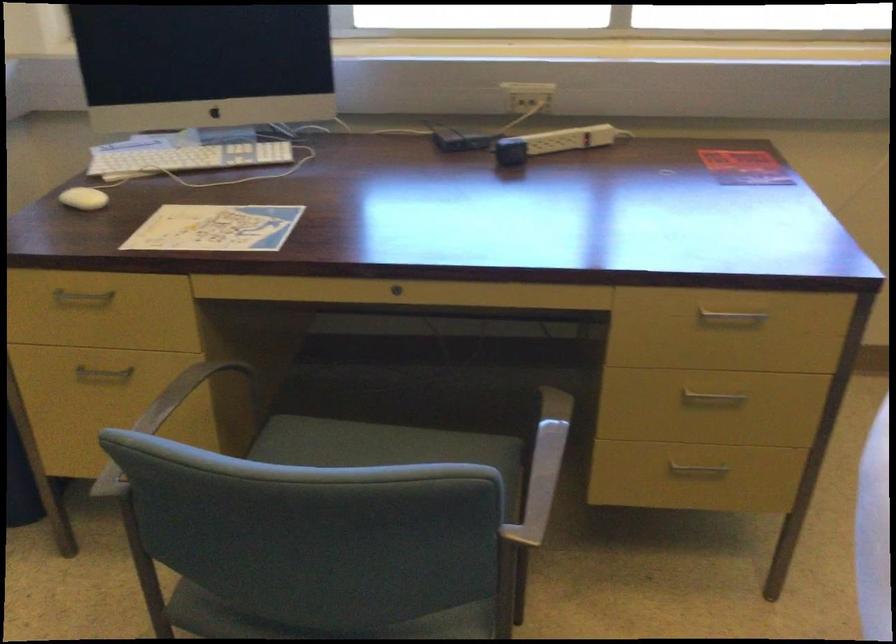
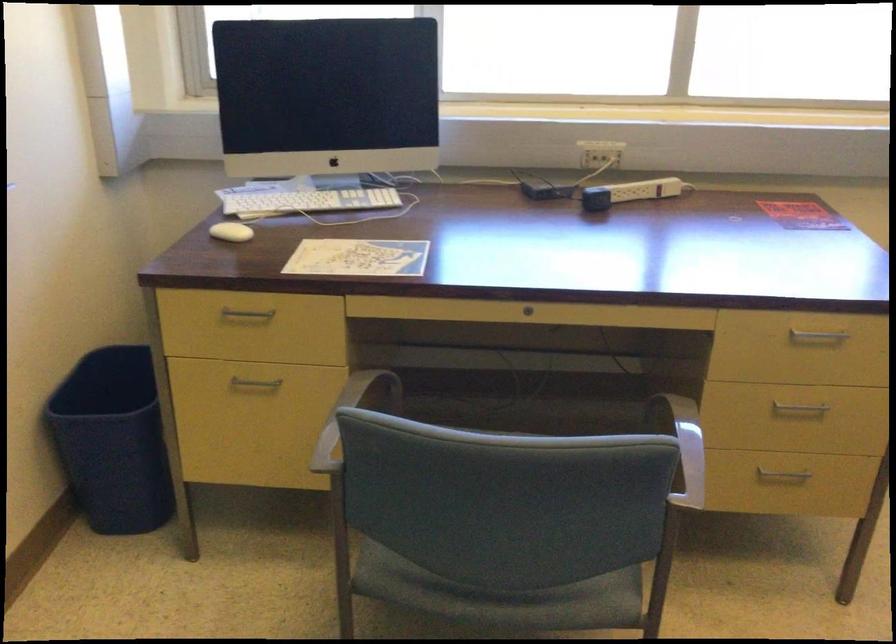
Where in the second image is the point corresponding to (538,462) from the first image?

(684, 446)